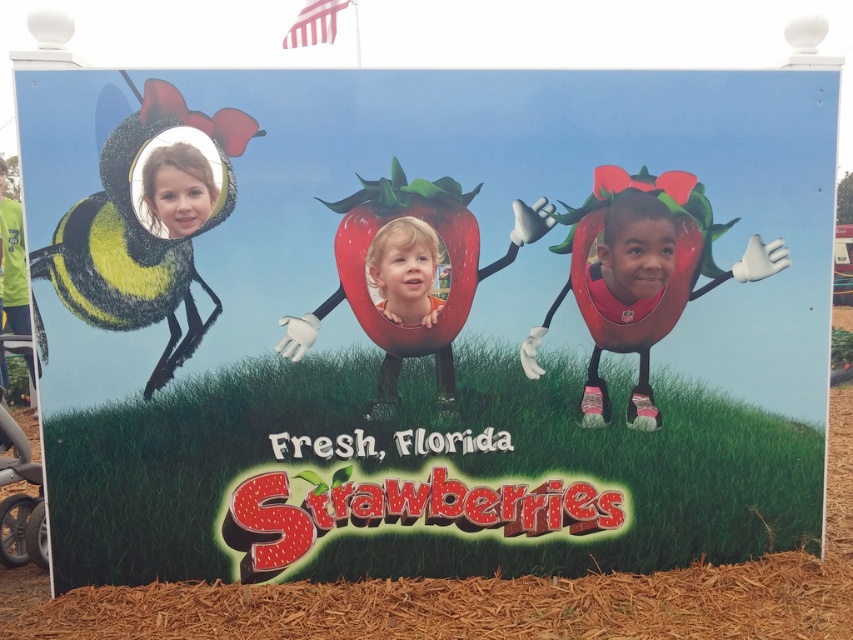
Question: Where is smooth orange shirt at center located in relation to smooth skin face at upper left in the image?

Choices:
 (A) left
 (B) right

Answer: (B)

Question: Does smooth orange shirt at center have a lesser width compared to smooth skin face at upper left?

Choices:
 (A) yes
 (B) no

Answer: (B)

Question: Does smooth orange shirt at center appear on the left side of smooth skin face at upper left?

Choices:
 (A) no
 (B) yes

Answer: (A)

Question: Which of the following is the farthest from the observer?

Choices:
 (A) (184, 193)
 (B) (407, 246)

Answer: (B)